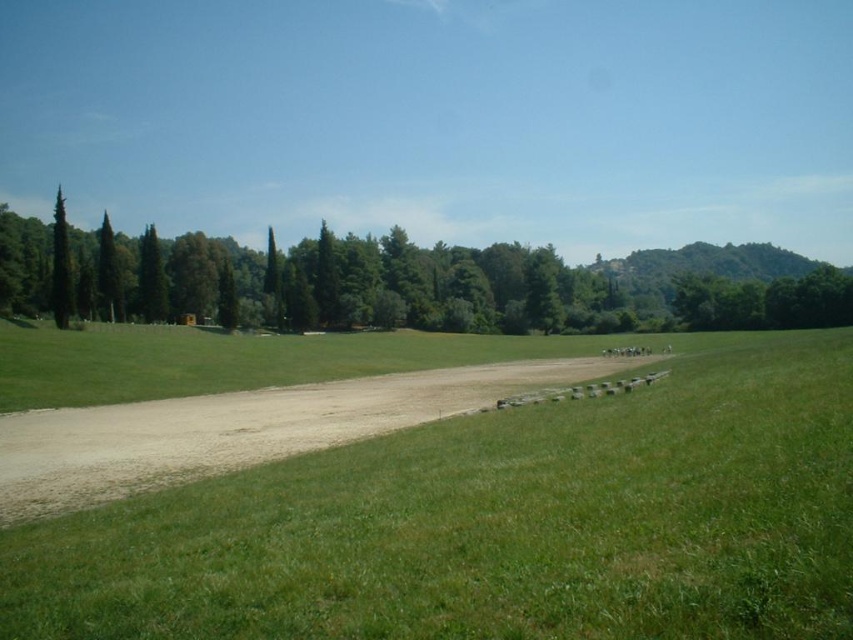
Which is above, green grassy field at center or brown gravel dirt track at center?

Positioned higher is green grassy field at center.

Describe the element at coordinates (496, 524) in the screenshot. I see `green grassy field at center` at that location.

This screenshot has height=640, width=853. I want to click on green grassy field at center, so click(x=496, y=524).

Can you confirm if green leafy tree at left is positioned to the right of green matte tree at left?

Yes, green leafy tree at left is to the right of green matte tree at left.

Does point (695, 282) lie behind point (68, 248)?

Yes, point (695, 282) is farther from viewer.

Locate an element on the screen. This screenshot has height=640, width=853. green leafy tree at left is located at coordinates (445, 284).

Is point (515, 444) more distant than point (56, 291)?

That is False.

Does green grassy field at center have a smaller size compared to green matte tree at left?

Correct, green grassy field at center occupies less space than green matte tree at left.

Find the location of `green grassy field at center`. green grassy field at center is located at coordinates (496, 524).